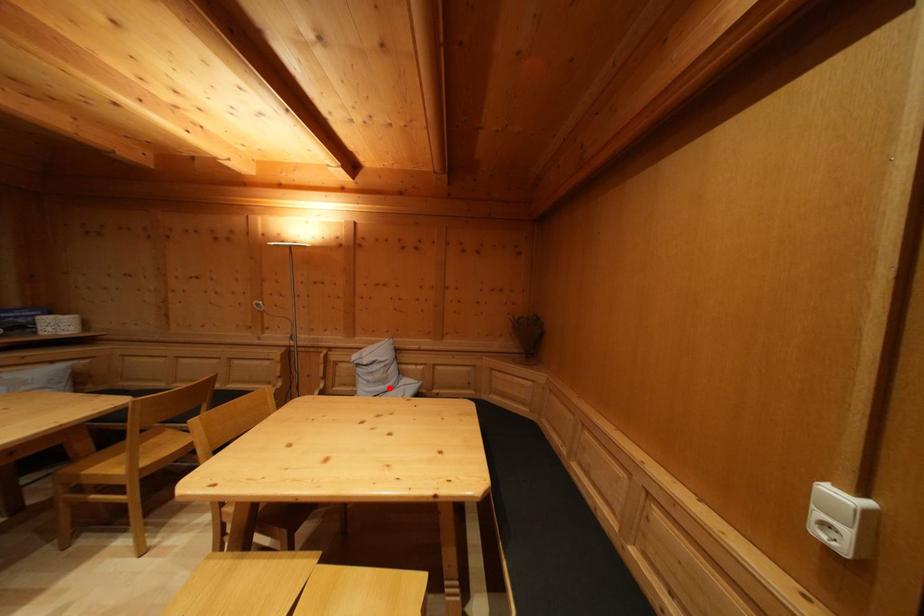
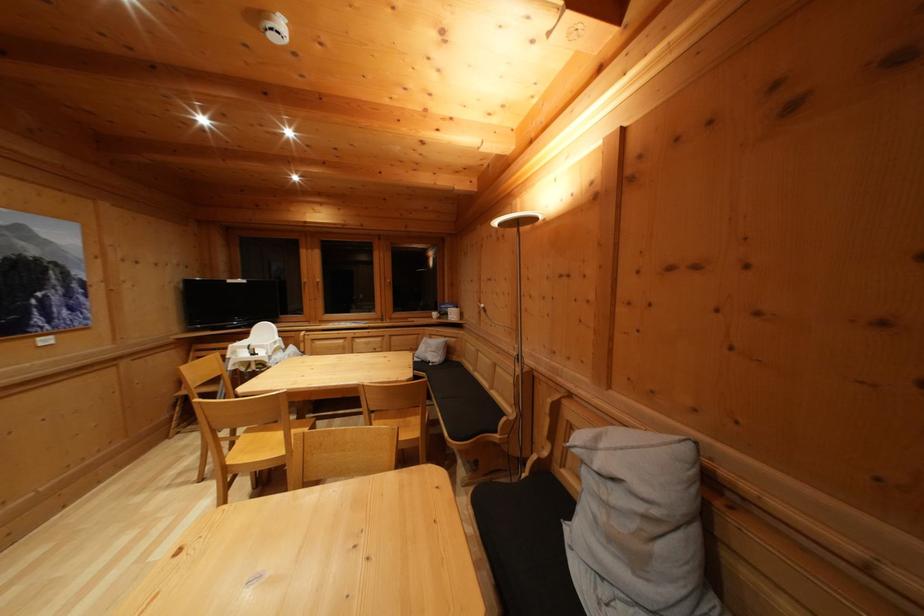
The point at the highlighted location is marked in the first image. Where is the corresponding point in the second image?

(640, 565)